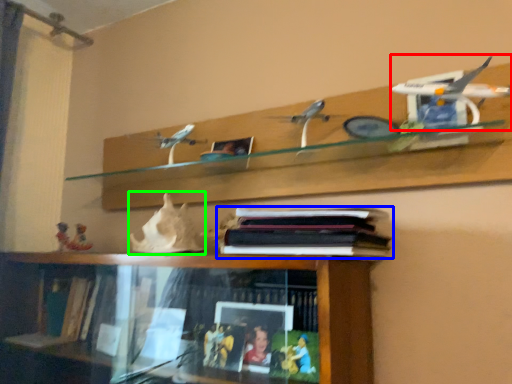
Question: Which is farther away from aircraft model (highlighted by a red box)? book (highlighted by a blue box) or toy (highlighted by a green box)?

Choices:
 (A) book
 (B) toy

Answer: (B)